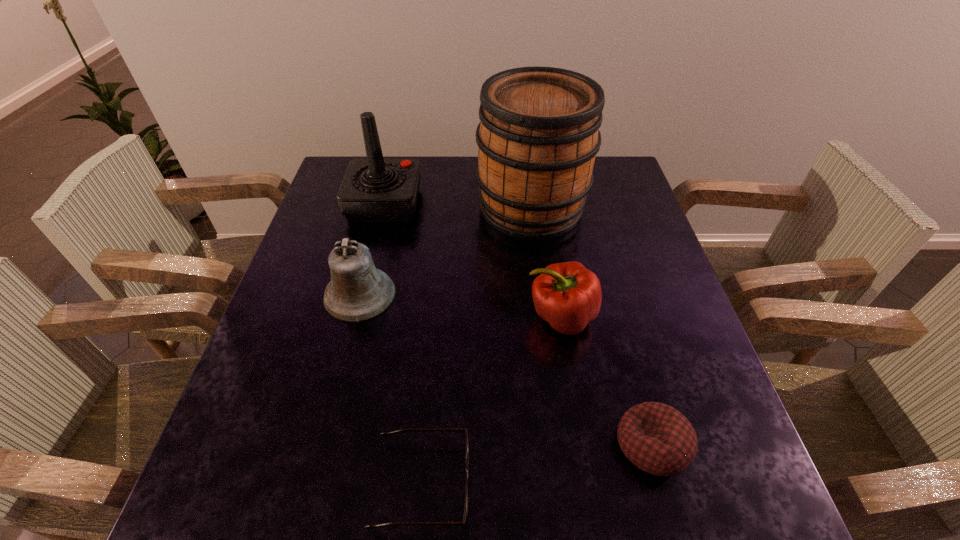
Find the location of a particular element. The width and height of the screenshot is (960, 540). beanbag at the right edge is located at coordinates (657, 438).

Image resolution: width=960 pixels, height=540 pixels. In order to click on object that is at the far left corner in this screenshot , I will do `click(375, 190)`.

The height and width of the screenshot is (540, 960). I want to click on object that is at the far right corner, so click(x=538, y=136).

Locate an element on the screen. The image size is (960, 540). object that is at the near right corner is located at coordinates (657, 438).

Find the location of a particular element. The image size is (960, 540). vacant region at the far edge is located at coordinates (450, 179).

Locate an element on the screen. This screenshot has height=540, width=960. vacant space at the near edge of the desktop is located at coordinates (511, 476).

Image resolution: width=960 pixels, height=540 pixels. In order to click on vacant space at the left edge of the desktop in this screenshot , I will do (275, 339).

In the image, there is a desktop. In order to click on vacant space at the right edge in this screenshot , I will do `click(696, 457)`.

Where is `free space at the far right corner of the desktop`? The image size is (960, 540). free space at the far right corner of the desktop is located at coordinates (611, 193).

The height and width of the screenshot is (540, 960). Identify the location of vacant space that's between the bell pepper and the fifth shortest object. (472, 260).